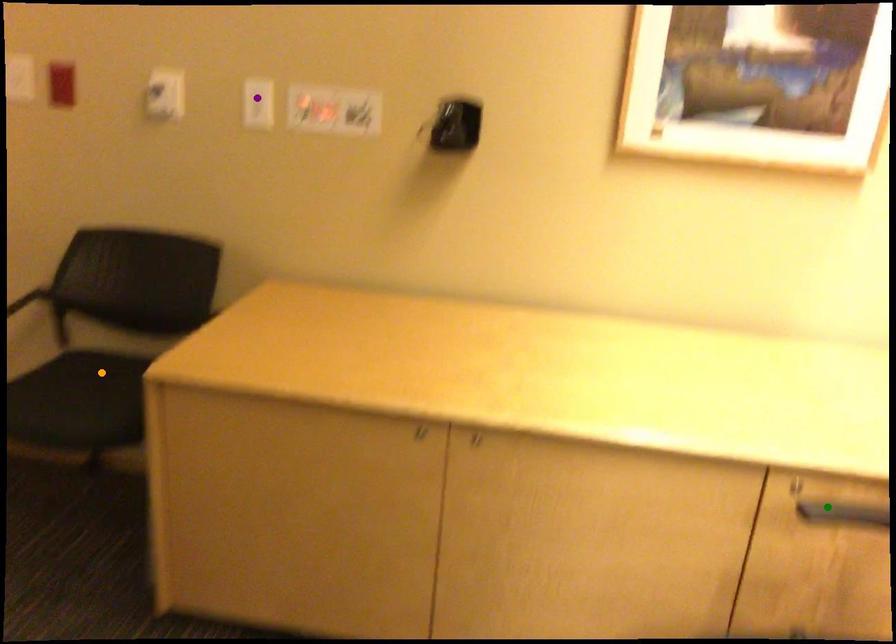
Based on the photo, order these from nearest to farthest:
- green point
- orange point
- purple point

green point → purple point → orange point